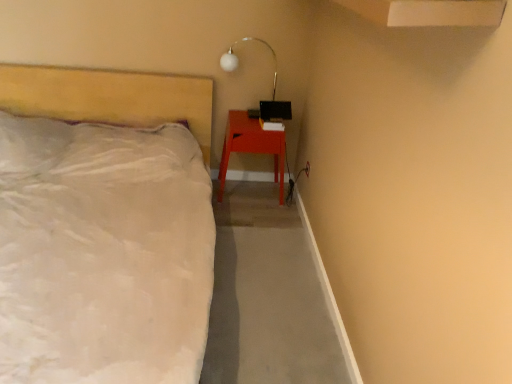
From the picture: Measure the distance between point (279,175) and camera.

Point (279,175) and camera are 2.93 meters apart.

The height and width of the screenshot is (384, 512). In order to click on matte white bed at left in this screenshot , I will do `click(104, 226)`.

This screenshot has height=384, width=512. What are the coordinates of `white glass lamp at upper center` in the screenshot? It's located at (238, 60).

In the image, is matte wood nightstand at lower right on the left side or the right side of matte white bed at left?

In the image, matte wood nightstand at lower right appears on the right side of matte white bed at left.

Choose the correct answer: Is matte wood nightstand at lower right inside matte white bed at left or outside it?

matte wood nightstand at lower right is outside matte white bed at left.

Is matte wood nightstand at lower right directly adjacent to matte white bed at left?

No, matte wood nightstand at lower right is not next to matte white bed at left.

Could you tell me if matte wood nightstand at lower right is turned towards matte white bed at left?

No, matte wood nightstand at lower right is not facing towards matte white bed at left.

Is point (10, 165) closer or farther from the camera than point (241, 119)?

Clearly, point (10, 165) is closer to the camera than point (241, 119).

From a real-world perspective, who is located higher, matte white bed at left or matte wood nightstand at lower right?

In real-world perspective, matte white bed at left is above.

Is matte white bed at left surrounding matte wood nightstand at lower right?

Definitely not — matte wood nightstand at lower right is not inside matte white bed at left.

Considering the sizes of objects matte white bed at left and matte wood nightstand at lower right in the image provided, who is shorter, matte white bed at left or matte wood nightstand at lower right?

Standing shorter between the two is matte wood nightstand at lower right.

Which is closer to the camera, (265,44) or (42,319)?

Point (265,44) appears to be farther away from the viewer than point (42,319).

Is white glass lamp at upper center taller than matte white bed at left?

In fact, white glass lamp at upper center may be shorter than matte white bed at left.

Who is smaller, white glass lamp at upper center or matte white bed at left?

With smaller size is white glass lamp at upper center.

From a real-world perspective, which is physically below, matte white bed at left or white glass lamp at upper center?

matte white bed at left is physically lower.

From the image's perspective, does matte white bed at left appear higher than white glass lamp at upper center?

No, from the image's perspective, matte white bed at left is not over white glass lamp at upper center.

Does matte white bed at left touch white glass lamp at upper center?

No, matte white bed at left is not beside white glass lamp at upper center.

From their relative heights in the image, would you say matte white bed at left is taller or shorter than white glass lamp at upper center?

Clearly, matte white bed at left is taller compared to white glass lamp at upper center.

Between white glass lamp at upper center and matte wood nightstand at lower right, which one appears on the left side from the viewer's perspective?

Positioned to the left is white glass lamp at upper center.

Does point (231, 57) lie behind point (268, 136)?

No, it is in front of (268, 136).

Is matte wood nightstand at lower right located within white glass lamp at upper center?

No.

At what (x,y) coordinates should I click in order to perform the action: click on lamp on the left of matte wood nightstand at lower right. Please return your answer as a coordinate pair (x, y). This screenshot has width=512, height=384. Looking at the image, I should click on (238, 60).

Considering the sizes of objects matte wood nightstand at lower right and white glass lamp at upper center in the image provided, who is taller, matte wood nightstand at lower right or white glass lamp at upper center?

Standing taller between the two is matte wood nightstand at lower right.

How many degrees apart are the facing directions of matte wood nightstand at lower right and white glass lamp at upper center?

0.415 degrees.

Who is more distant, matte wood nightstand at lower right or white glass lamp at upper center?

matte wood nightstand at lower right is further away from the camera.

Is point (248, 126) more distant than point (225, 55)?

Yes, it is behind point (225, 55).

I want to click on bed located in front of the matte wood nightstand at lower right, so click(x=104, y=226).

The height and width of the screenshot is (384, 512). In order to click on nightstand behind the matte white bed at left in this screenshot , I will do `click(251, 147)`.

Looking at the image, which one is located further to matte wood nightstand at lower right, matte white bed at left or white glass lamp at upper center?

Based on the image, matte white bed at left appears to be further to matte wood nightstand at lower right.

Looking at the image, which one is located further to white glass lamp at upper center, matte wood nightstand at lower right or matte white bed at left?

matte white bed at left is further to white glass lamp at upper center.

Based on their spatial positions, is matte wood nightstand at lower right or white glass lamp at upper center further from matte white bed at left?

white glass lamp at upper center is further to matte white bed at left.

Based on their spatial positions, is matte white bed at left or matte wood nightstand at lower right closer to white glass lamp at upper center?

matte wood nightstand at lower right.

From the image, which object appears to be farther from matte white bed at left, white glass lamp at upper center or matte wood nightstand at lower right?

white glass lamp at upper center is further to matte white bed at left.

Considering their positions, is white glass lamp at upper center positioned further to matte wood nightstand at lower right than matte white bed at left?

matte white bed at left is positioned further to the anchor matte wood nightstand at lower right.

Locate an element on the screen. Image resolution: width=512 pixels, height=384 pixels. lamp between matte white bed at left and matte wood nightstand at lower right from front to back is located at coordinates (238, 60).